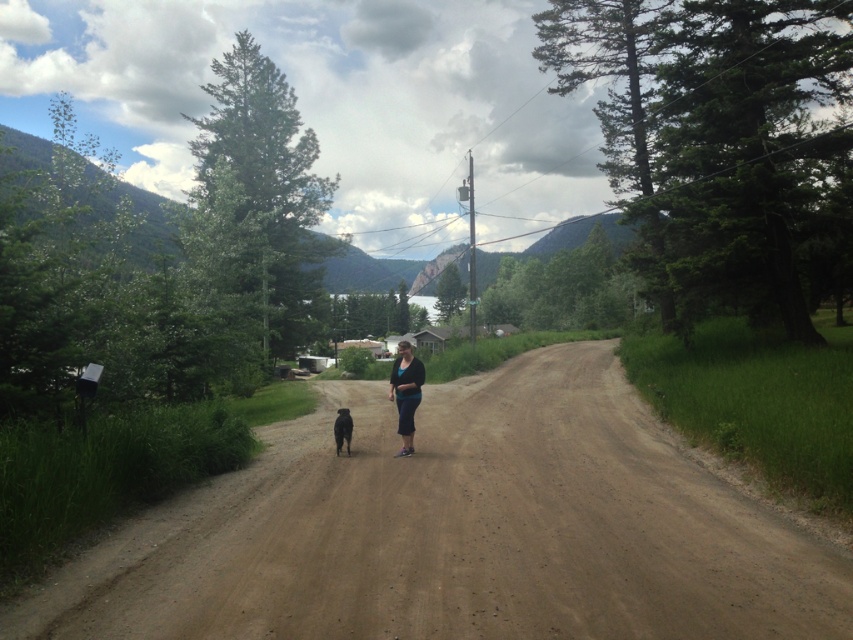
Is brown dirt track at center thinner than matte black pants at center?

Incorrect, brown dirt track at center's width is not less than matte black pants at center's.

Is brown dirt track at center behind matte black pants at center?

No, brown dirt track at center is in front of matte black pants at center.

Does point (33, 618) come farther from viewer compared to point (410, 344)?

No, (33, 618) is closer to viewer.

At what (x,y) coordinates should I click in order to perform the action: click on brown dirt track at center. Please return your answer as a coordinate pair (x, y). This screenshot has height=640, width=853. Looking at the image, I should click on (459, 529).

Does matte black pants at center have a greater height compared to black fur dog at center?

Yes, matte black pants at center is taller than black fur dog at center.

Who is more forward, (407, 372) or (340, 432)?

Point (407, 372) is in front.

Describe the element at coordinates (405, 392) in the screenshot. I see `matte black pants at center` at that location.

At what (x,y) coordinates should I click in order to perform the action: click on matte black pants at center. Please return your answer as a coordinate pair (x, y). This screenshot has width=853, height=640. Looking at the image, I should click on (405, 392).

Is brown dirt track at center below black fur dog at center?

Correct, brown dirt track at center is located below black fur dog at center.

Is point (386, 438) farther from viewer compared to point (345, 420)?

Yes.

Identify the location of brown dirt track at center. (459, 529).